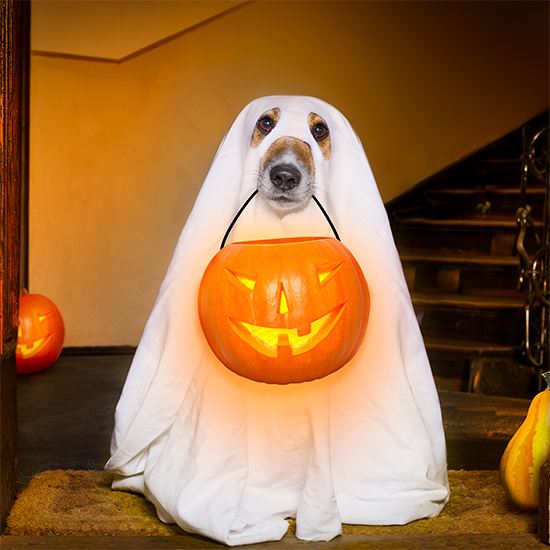
The width and height of the screenshot is (550, 550). What are the coordinates of `sheet` in the screenshot? It's located at tap(344, 152).